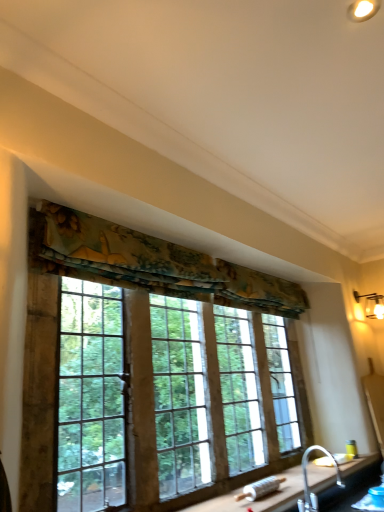
Question: Considering the positions of silver metallic faucet at lower right and matte white wall sconce at upper right in the image, is silver metallic faucet at lower right bigger or smaller than matte white wall sconce at upper right?

Choices:
 (A) small
 (B) big

Answer: (B)

Question: From a real-world perspective, is silver metallic faucet at lower right physically located above or below matte white wall sconce at upper right?

Choices:
 (A) below
 (B) above

Answer: (A)

Question: Which object is the farthest from the black granite countertop at lower right?

Choices:
 (A) textured floral fabric at upper center
 (B) matte white wall sconce at upper right
 (C) textured fabric valance at upper center
 (D) silver metallic faucet at lower right

Answer: (B)

Question: Which object is positioned farthest from the matte white wall sconce at upper right?

Choices:
 (A) silver metallic faucet at lower right
 (B) textured floral fabric at upper center
 (C) black granite countertop at lower right
 (D) textured fabric valance at upper center

Answer: (D)